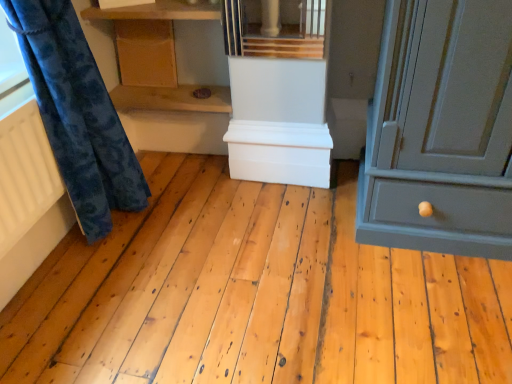
Question: Is white matte radiator at left at the left side of velvety blue curtain at left?

Choices:
 (A) yes
 (B) no

Answer: (A)

Question: From the image's perspective, would you say white matte radiator at left is positioned over velvety blue curtain at left?

Choices:
 (A) yes
 (B) no

Answer: (B)

Question: Could you tell me if white matte radiator at left is turned towards velvety blue curtain at left?

Choices:
 (A) yes
 (B) no

Answer: (A)

Question: Is white matte radiator at left taller than velvety blue curtain at left?

Choices:
 (A) no
 (B) yes

Answer: (A)

Question: Is the position of white matte radiator at left more distant than that of velvety blue curtain at left?

Choices:
 (A) no
 (B) yes

Answer: (B)

Question: Is white matte radiator at left inside or outside of wooden cabinet at upper center, placed as the first cabinetry when sorted from top to bottom?

Choices:
 (A) inside
 (B) outside

Answer: (B)

Question: Does point (53, 175) appear closer or farther from the camera than point (172, 41)?

Choices:
 (A) closer
 (B) farther

Answer: (A)

Question: Considering the positions of white matte radiator at left and wooden cabinet at upper center, which is the 2th cabinetry in bottom-to-top order, in the image, is white matte radiator at left taller or shorter than wooden cabinet at upper center, which is the 2th cabinetry in bottom-to-top order,?

Choices:
 (A) tall
 (B) short

Answer: (A)

Question: From a real-world perspective, is white matte radiator at left physically located above or below wooden cabinet at upper center, placed as the first cabinetry when sorted from top to bottom?

Choices:
 (A) below
 (B) above

Answer: (A)

Question: Is white matte radiator at left wider or thinner than wooden shelf at center, which is counted as the 1th shelf, starting from the bottom?

Choices:
 (A) wide
 (B) thin

Answer: (B)

Question: Relative to wooden shelf at center, which is counted as the 1th shelf, starting from the bottom, is white matte radiator at left in front or behind?

Choices:
 (A) front
 (B) behind

Answer: (A)

Question: Is point (2, 124) positioned closer to the camera than point (224, 91)?

Choices:
 (A) closer
 (B) farther

Answer: (A)

Question: Is white matte radiator at left inside or outside of wooden shelf at center, the second shelf positioned from the top?

Choices:
 (A) inside
 (B) outside

Answer: (B)

Question: From the image's perspective, is white matte chest at center, which ranks as the first cabinetry in right-to-left order, located above or below white matte radiator at left?

Choices:
 (A) below
 (B) above

Answer: (B)

Question: Looking at their shapes, would you say white matte chest at center, placed as the 1th cabinetry when sorted from bottom to top, is wider or thinner than white matte radiator at left?

Choices:
 (A) wide
 (B) thin

Answer: (A)